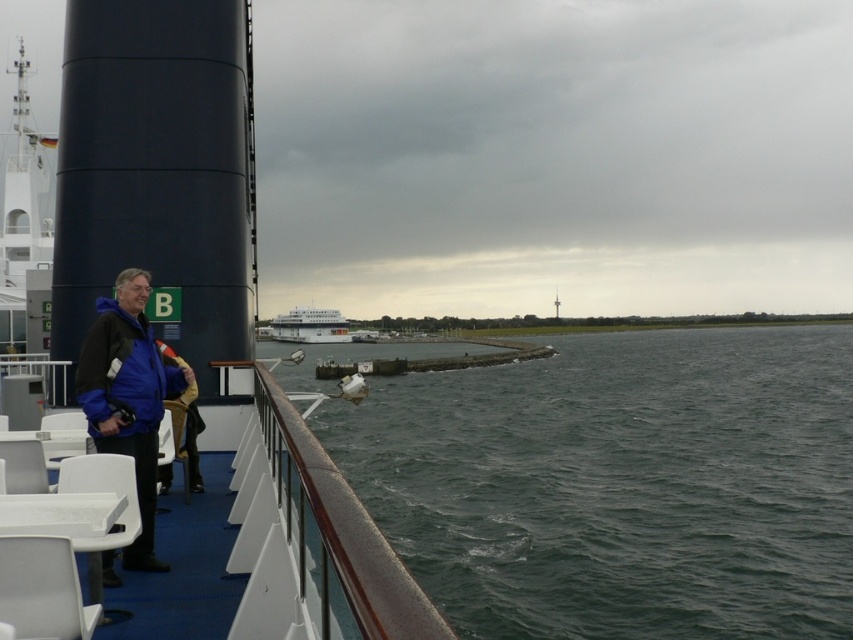
Question: Among these points, which one is nearest to the camera?

Choices:
 (A) [x=634, y=435]
 (B) [x=106, y=388]

Answer: (B)

Question: Is matte black boat at left thinner than blue fabric jacket at left?

Choices:
 (A) yes
 (B) no

Answer: (B)

Question: Does matte black boat at left lie in front of blue fabric jacket at lower left?

Choices:
 (A) no
 (B) yes

Answer: (B)

Question: Which point appears closest to the camera in this image?

Choices:
 (A) (724, 637)
 (B) (126, 344)
 (C) (183, 449)

Answer: (B)

Question: Based on their relative distances, which object is nearer to the dark green water at center?

Choices:
 (A) white glossy cruise ship at center
 (B) blue fabric jacket at left
 (C) blue fabric jacket at lower left

Answer: (C)

Question: From the image, what is the correct spatial relationship of dark green water at center in relation to blue fabric jacket at left?

Choices:
 (A) right
 (B) left

Answer: (A)